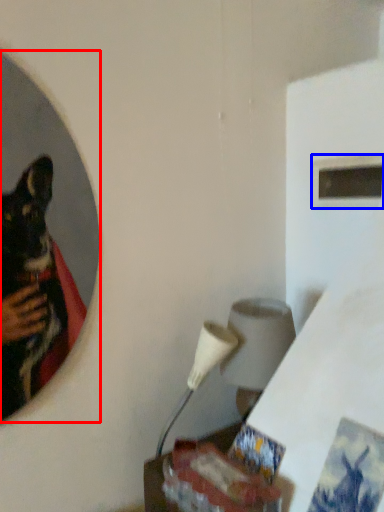
Question: Which point is further to the camera, mirror (highlighted by a red box) or window (highlighted by a blue box)?

Choices:
 (A) mirror
 (B) window

Answer: (B)